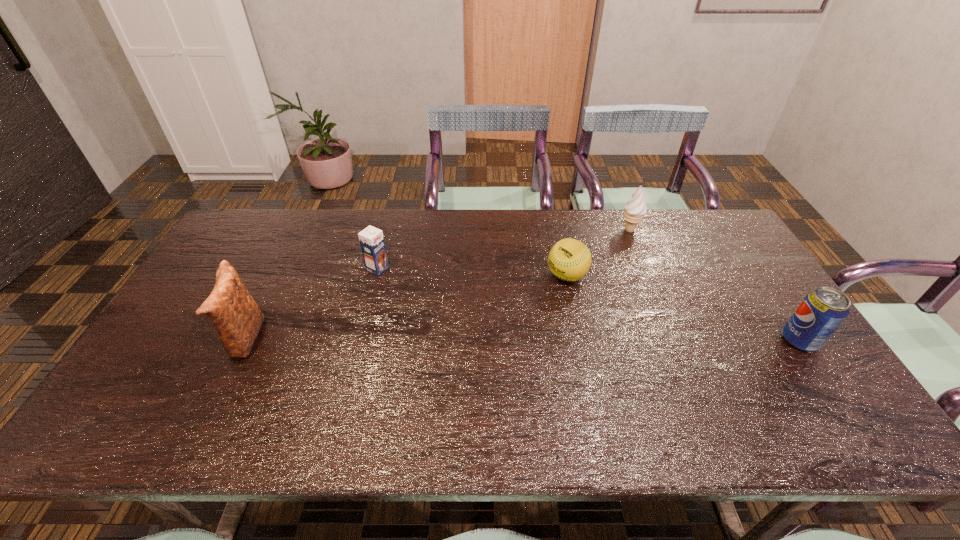
Where is `object at the far edge`? object at the far edge is located at coordinates (635, 208).

The height and width of the screenshot is (540, 960). In order to click on object that is at the right edge in this screenshot , I will do `click(822, 311)`.

The height and width of the screenshot is (540, 960). I want to click on free spot at the far edge of the desktop, so click(287, 220).

Image resolution: width=960 pixels, height=540 pixels. Identify the location of vacant space at the near edge of the desktop. (341, 403).

Find the location of `vacant space at the left edge of the desktop`. vacant space at the left edge of the desktop is located at coordinates (236, 255).

The image size is (960, 540). Identify the location of free space at the right edge of the desktop. (719, 289).

Locate an element on the screen. This screenshot has width=960, height=540. free space at the far left corner is located at coordinates (256, 235).

You are a GUI agent. You are given a task and a screenshot of the screen. Output one action in this format:
    pyautogui.click(x=<x>, y=<y>)
    Task: Click on the vacant region at the near left corner of the desktop
    
    Given the screenshot: What is the action you would take?
    pyautogui.click(x=186, y=381)

In the image, there is a desktop. Identify the location of vacant space at the far right corner. (679, 210).

This screenshot has height=540, width=960. What are the coordinates of `free space between the second object from left to right and the rightmost object` in the screenshot? It's located at (588, 305).